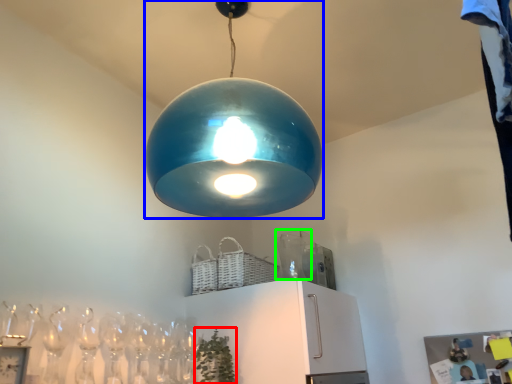
Question: Which object is positioned farthest from plant (highlighted by a red box)? Select from lamp (highlighted by a blue box) and glass vase (highlighted by a green box).

Choices:
 (A) lamp
 (B) glass vase

Answer: (A)